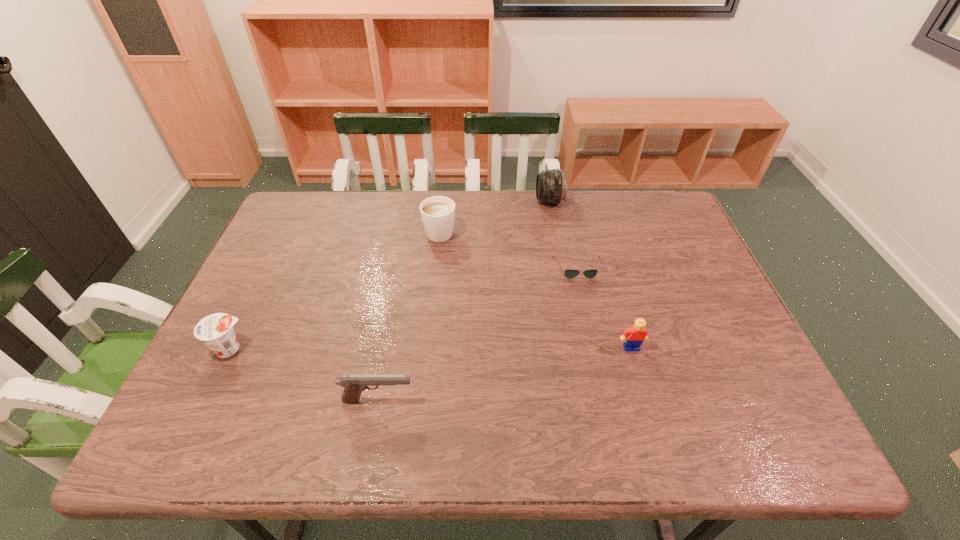
Locate an element on the screen. This screenshot has height=540, width=960. vacant region between the telephoto lens and the fourth nearest object is located at coordinates (564, 234).

Identify the location of vacant area that lies between the farthest object and the leftmost object. This screenshot has width=960, height=540. (390, 275).

Locate an element on the screen. The height and width of the screenshot is (540, 960). vacant area between the shortest object and the nearest object is located at coordinates (478, 334).

The image size is (960, 540). I want to click on vacant area that lies between the shortest object and the telephoto lens, so click(x=564, y=234).

At what (x,y) coordinates should I click in order to perform the action: click on free space between the nearest object and the shortest object. Please return your answer as a coordinate pair (x, y). This screenshot has width=960, height=540. Looking at the image, I should click on (478, 334).

Where is `free space between the nearest object and the cappuccino`? Image resolution: width=960 pixels, height=540 pixels. free space between the nearest object and the cappuccino is located at coordinates (409, 315).

The image size is (960, 540). I want to click on object that stands as the fifth closest to the Lego, so click(x=216, y=330).

The image size is (960, 540). I want to click on object that can be found as the closest to the Lego, so click(569, 273).

The image size is (960, 540). I want to click on vacant region that satisfies the following two spatial constraints: 1. on the lenses of the sunglasses; 2. at the barrel of the pistol, so click(x=608, y=401).